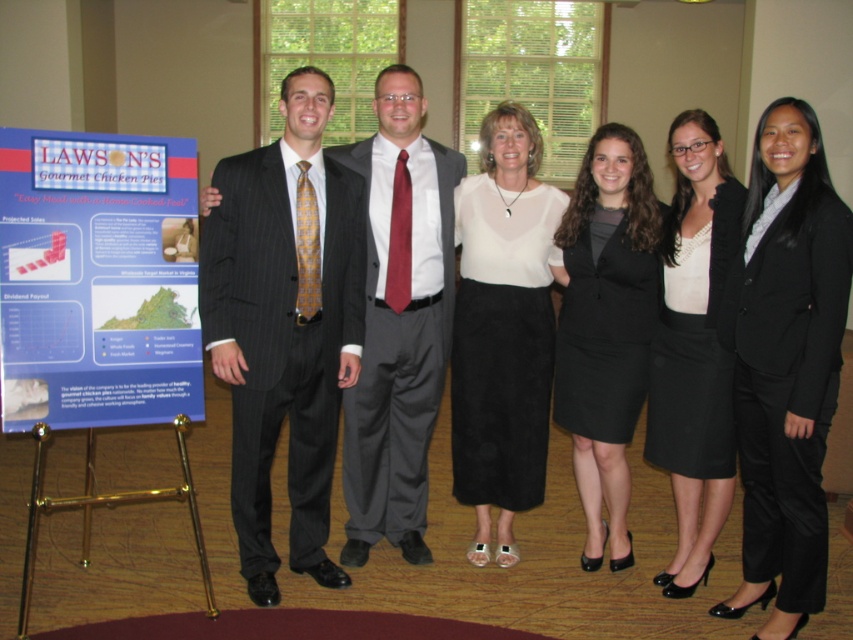
Question: Can you confirm if black fabric skirt at center is positioned below white matte blazer at center?

Choices:
 (A) yes
 (B) no

Answer: (B)

Question: Can you confirm if black fabric skirt at center is positioned to the left of white matte blazer at center?

Choices:
 (A) no
 (B) yes

Answer: (B)

Question: Can you confirm if black satin blazer at center is positioned below white matte blazer at center?

Choices:
 (A) no
 (B) yes

Answer: (B)

Question: Based on their relative distances, which object is farther from the dark gray pinstripe suit at center?

Choices:
 (A) black fabric skirt at center
 (B) blue paperboard poster at left

Answer: (B)

Question: Which of the following is the closest to the observer?

Choices:
 (A) black satin blazer at center
 (B) pinstripe suit at center
 (C) white matte blazer at center

Answer: (A)

Question: Which of the following is the farthest from the observer?

Choices:
 (A) black satin blazer at center
 (B) blue paperboard poster at left
 (C) white matte blazer at center

Answer: (C)